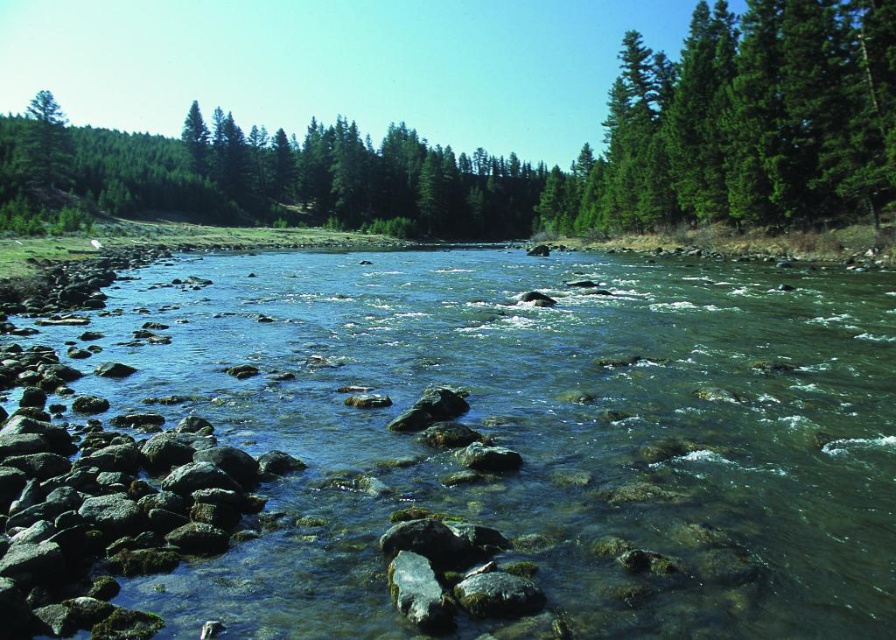
Between clear water at center and green matte tree at upper left, which one appears on the left side from the viewer's perspective?

From the viewer's perspective, green matte tree at upper left appears more on the left side.

Is clear water at center above green matte tree at upper left?

Incorrect, clear water at center is not positioned above green matte tree at upper left.

What are the coordinates of `clear water at center` in the screenshot? It's located at (533, 433).

Identify the location of clear water at center. This screenshot has height=640, width=896. pos(533,433).

Is point (816, 22) farther from viewer compared to point (54, 163)?

That is False.

Between point (886, 88) and point (54, 160), which one is positioned behind?

The point (54, 160) is more distant.

Is point (791, 205) closer to viewer compared to point (35, 157)?

Yes, it is in front of point (35, 157).

You are a GUI agent. You are given a task and a screenshot of the screen. Output one action in this format:
    pyautogui.click(x=<x>, y=<y>)
    Task: Click on the green textured tree at upper right
    Image resolution: width=896 pixels, height=640 pixels.
    Given the screenshot: What is the action you would take?
    pyautogui.click(x=743, y=124)

Which is behind, point (851, 442) or point (578, 230)?

Point (578, 230)

You are a GUI agent. You are given a task and a screenshot of the screen. Output one action in this format:
    pyautogui.click(x=<x>, y=<y>)
    Task: Click on the clear water at center
    This screenshot has width=896, height=640.
    Given the screenshot: What is the action you would take?
    pyautogui.click(x=533, y=433)

Locate an element on the screen. clear water at center is located at coordinates (533, 433).